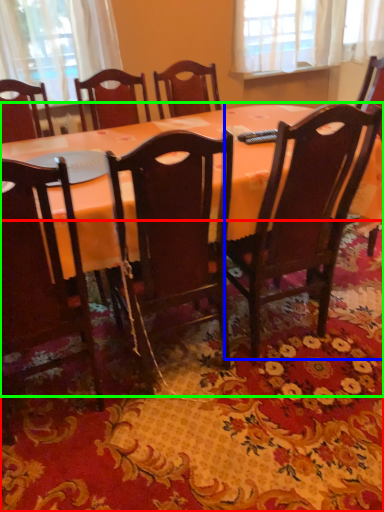
Question: Which is farther away from mat (highlighted by a red box)? chair (highlighted by a blue box) or table (highlighted by a green box)?

Choices:
 (A) chair
 (B) table

Answer: (B)